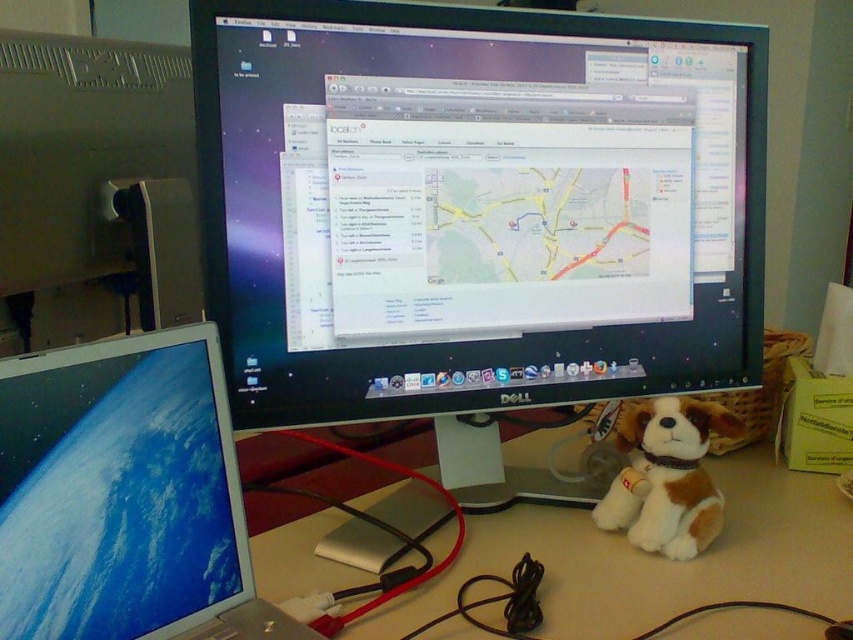
Describe the element at coordinates (474, 205) in the screenshot. I see `black glossy monitor at center` at that location.

Is black glossy monitor at center to the left of beige plastic computer desk at center from the viewer's perspective?

Yes, black glossy monitor at center is to the left of beige plastic computer desk at center.

Image resolution: width=853 pixels, height=640 pixels. What do you see at coordinates (474, 205) in the screenshot?
I see `black glossy monitor at center` at bounding box center [474, 205].

The height and width of the screenshot is (640, 853). I want to click on black glossy monitor at center, so click(474, 205).

Which is above, black glossy monitor at center or matte plastic laptop at left?

black glossy monitor at center is above.

In the scene shown: Does black glossy monitor at center have a lesser width compared to matte plastic laptop at left?

No.

Is point (605, 332) closer to camera compared to point (189, 372)?

No, it is behind (189, 372).

The height and width of the screenshot is (640, 853). Identify the location of black glossy monitor at center. (474, 205).

Who is positioned more to the left, matte plastic laptop at left or beige plastic computer desk at center?

matte plastic laptop at left

Between matte plastic laptop at left and beige plastic computer desk at center, which one has more height?

Standing taller between the two is matte plastic laptop at left.

You are a GUI agent. You are given a task and a screenshot of the screen. Output one action in this format:
    pyautogui.click(x=<x>, y=<y>)
    Task: Click on the matte plastic laptop at left
    This screenshot has height=640, width=853.
    Given the screenshot: What is the action you would take?
    pyautogui.click(x=117, y=488)